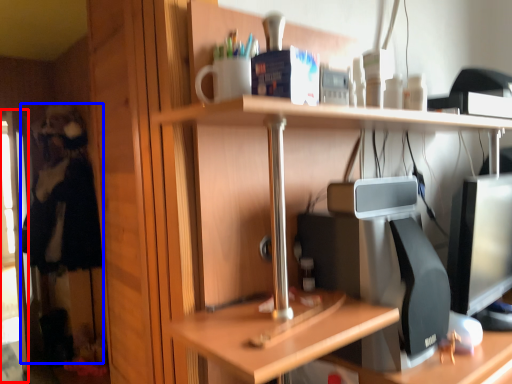
Question: Which point is further to the camera, screen door (highlighted by a red box) or person (highlighted by a blue box)?

Choices:
 (A) screen door
 (B) person

Answer: (A)